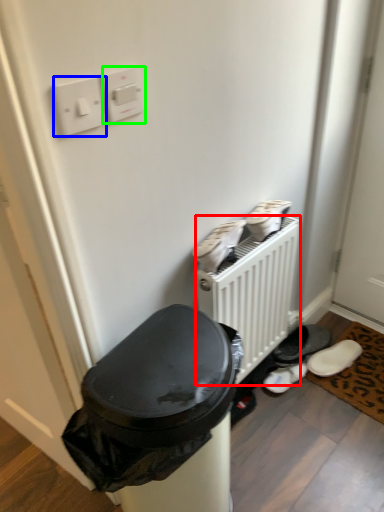
Question: Which is farther away from radiator (highlighted by a red box)? light switch (highlighted by a blue box) or light switch (highlighted by a green box)?

Choices:
 (A) light switch
 (B) light switch

Answer: (A)